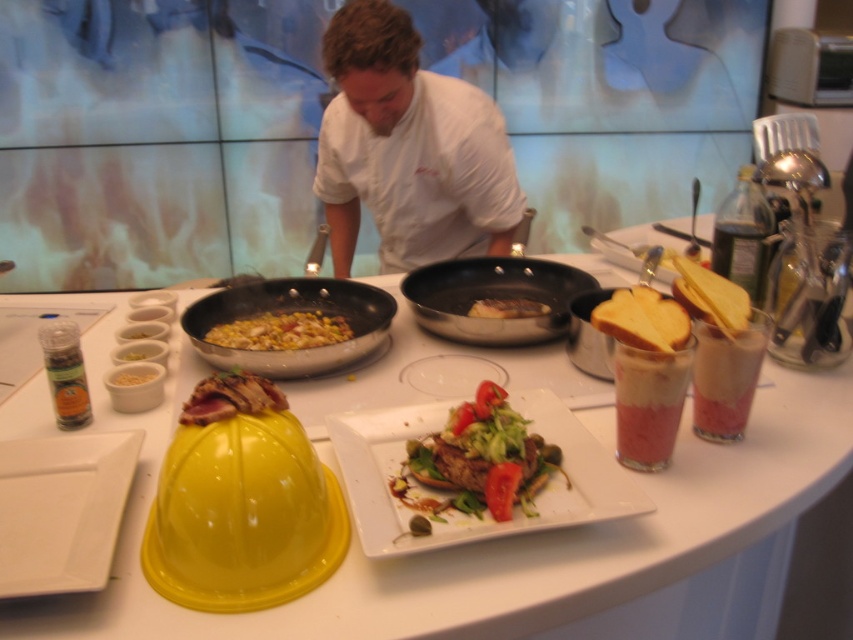
You are a chef preparing a dish and need to place both the shiny stainless steel wok at center and the yellow glossy corn at center on a shelf that can only hold items smaller than the wok. Can you fit both items on the shelf?

The shiny stainless steel wok at center is larger in size than yellow glossy corn at center. Since the shelf can only hold items smaller than the wok, the yellow glossy corn at center can fit, but the wok cannot. Therefore, only the yellow glossy corn at center can be placed on the shelf.